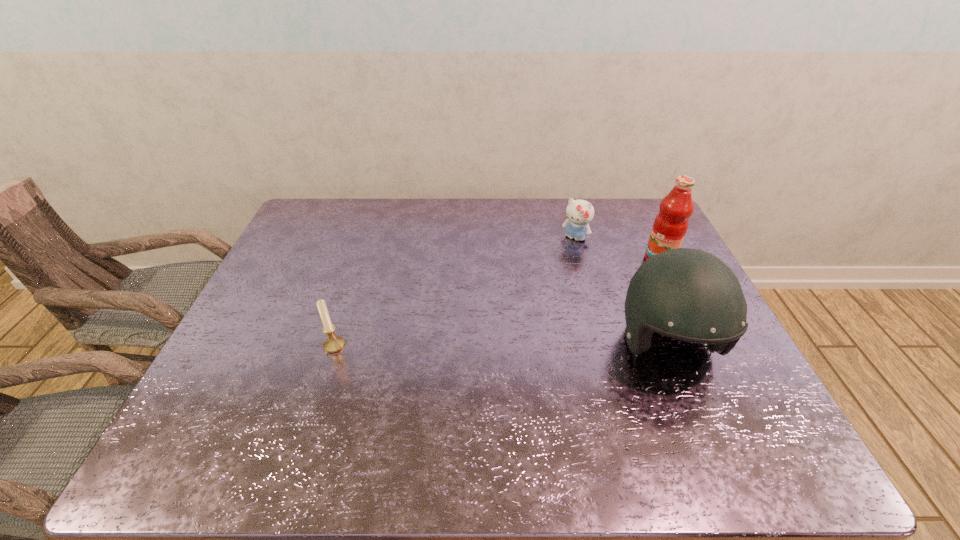
At what (x,y) coordinates should I click in order to perform the action: click on the leftmost object. Please return your answer as a coordinate pair (x, y). Looking at the image, I should click on (334, 343).

At what (x,y) coordinates should I click in order to perform the action: click on football helmet. Please return your answer as a coordinate pair (x, y). The image size is (960, 540). Looking at the image, I should click on (687, 294).

Where is `kitten`? The image size is (960, 540). kitten is located at coordinates (579, 213).

Where is `fruit juice`? The width and height of the screenshot is (960, 540). fruit juice is located at coordinates (670, 226).

The image size is (960, 540). In order to click on vacant space located 0.220m on the back of the candle holder in this screenshot , I will do coord(355,281).

Where is `free space located 0.060m at the face opening of the football helmet`? free space located 0.060m at the face opening of the football helmet is located at coordinates (696, 416).

Image resolution: width=960 pixels, height=540 pixels. Find the location of `vacant region located on the front-facing side of the farthest object`. vacant region located on the front-facing side of the farthest object is located at coordinates (546, 277).

You are a GUI agent. You are given a task and a screenshot of the screen. Output one action in this format:
    pyautogui.click(x=<x>, y=<y>)
    Task: Click on the free space located on the front-facing side of the farthest object
    The width and height of the screenshot is (960, 540).
    Given the screenshot: What is the action you would take?
    pyautogui.click(x=537, y=291)

The width and height of the screenshot is (960, 540). Identify the location of free space located on the front-facing side of the farthest object. (558, 261).

Image resolution: width=960 pixels, height=540 pixels. Identify the location of free location located on the front label of the fruit juice. (600, 293).